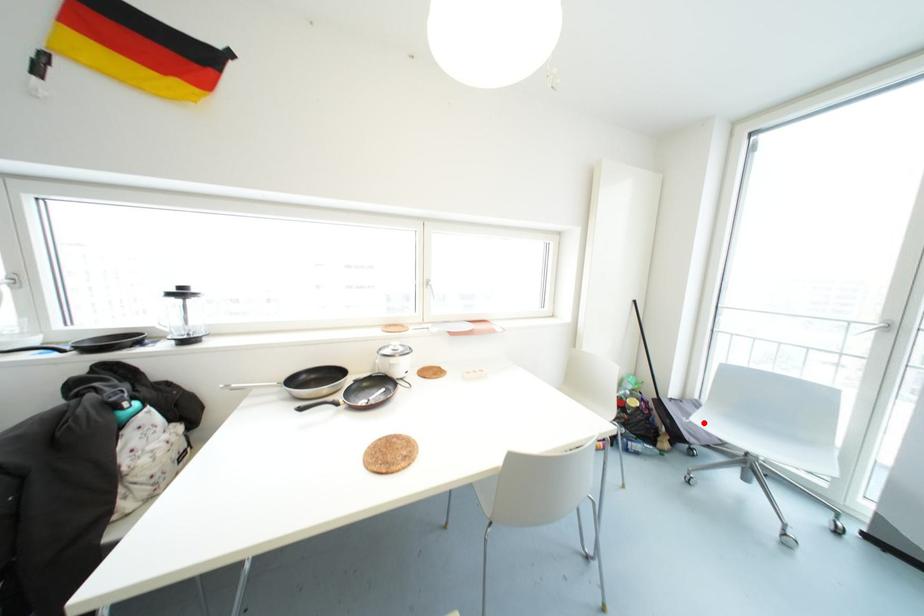
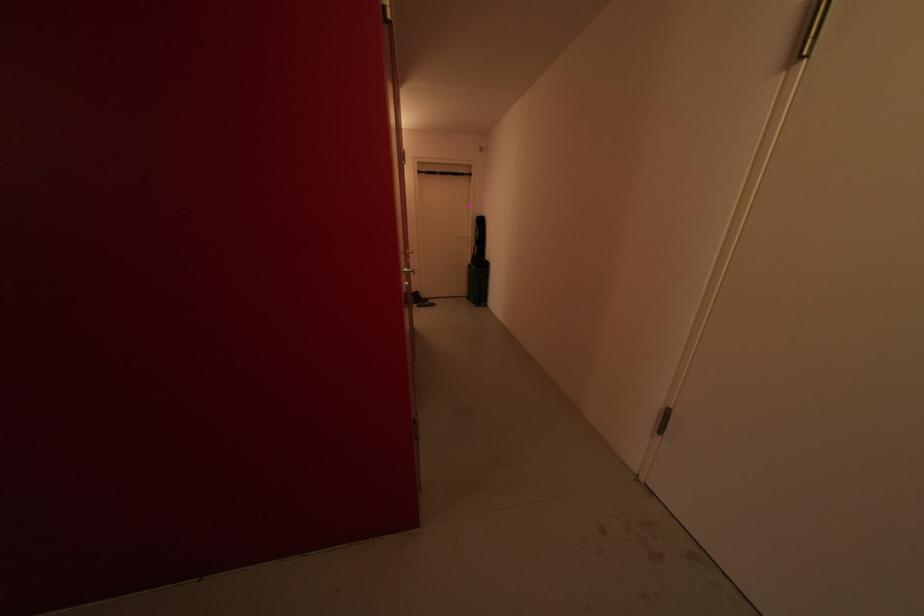
Question: I am providing you with two images of the same scene from different viewpoints. A red point is marked on the first image. Is the red point's position out of view in image 2?

Choices:
 (A) Yes
 (B) No

Answer: (A)